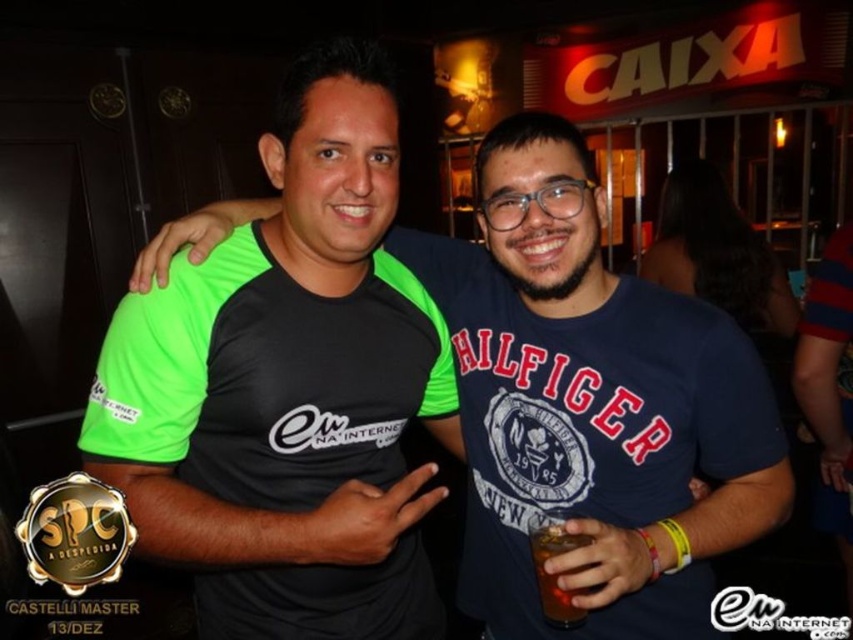
You are a photographer at the event and need to ensure that both the neon green fabric shirt at center and the brown liquid at center are in focus. The camera you are using has a depth of field that can cover 40 centimeters. Will both objects be in focus?

The distance between the neon green fabric shirt at center and the brown liquid at center is 39.91 centimeters, which is within the camera depth of field of 40 centimeters. Therefore, both objects will be in focus.